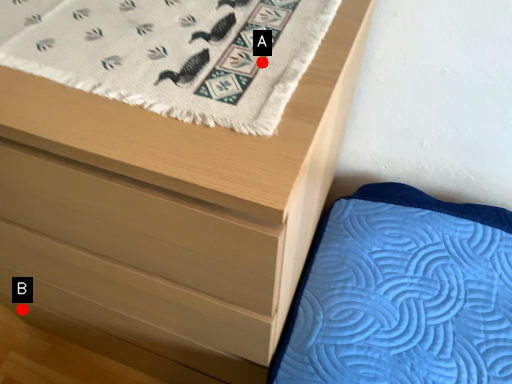
Question: Two points are circled on the image, labeled by A and B beside each circle. Which of the following is the closest to the observer?

Choices:
 (A) A is closer
 (B) B is closer

Answer: (A)